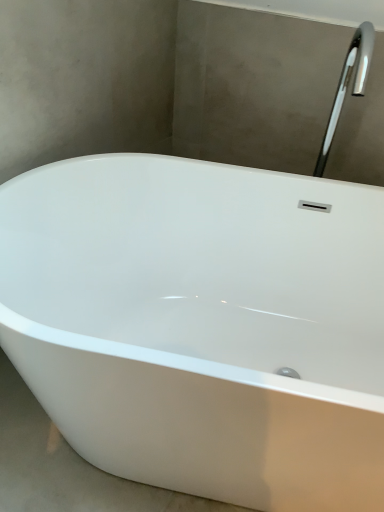
Question: Would you say polished chrome tap at upper right is inside or outside white glossy bathtub at center?

Choices:
 (A) outside
 (B) inside

Answer: (A)

Question: Is point (357, 32) positioned closer to the camera than point (311, 367)?

Choices:
 (A) closer
 (B) farther

Answer: (A)

Question: Based on their positions, is polished chrome tap at upper right located to the left or right of white glossy bathtub at center?

Choices:
 (A) left
 (B) right

Answer: (B)

Question: In terms of width, does white glossy bathtub at center look wider or thinner when compared to polished chrome tap at upper right?

Choices:
 (A) wide
 (B) thin

Answer: (A)

Question: From their relative heights in the image, would you say white glossy bathtub at center is taller or shorter than polished chrome tap at upper right?

Choices:
 (A) tall
 (B) short

Answer: (A)

Question: Do you think white glossy bathtub at center is within polished chrome tap at upper right, or outside of it?

Choices:
 (A) inside
 (B) outside

Answer: (B)

Question: Considering the positions of white glossy bathtub at center and polished chrome tap at upper right in the image, is white glossy bathtub at center bigger or smaller than polished chrome tap at upper right?

Choices:
 (A) big
 (B) small

Answer: (A)